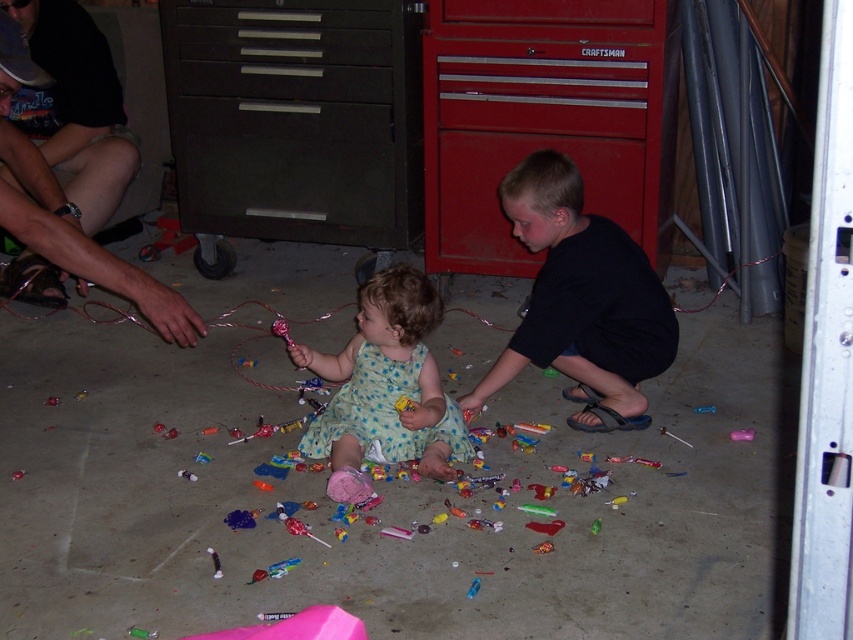
From the picture: What is the object located at the coordinates point (581, 300) in the scene?

The object located at point (581, 300) is the black matte shirt at center.